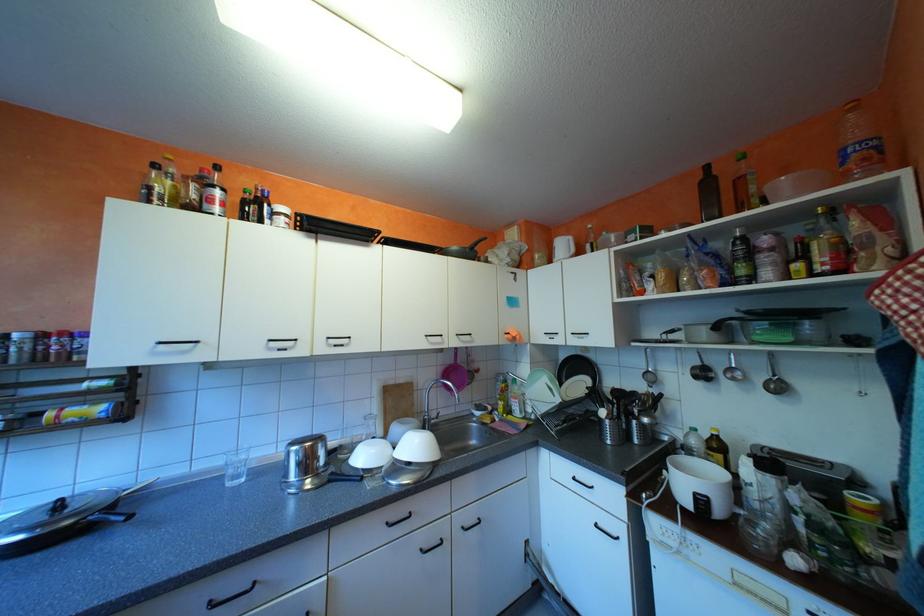
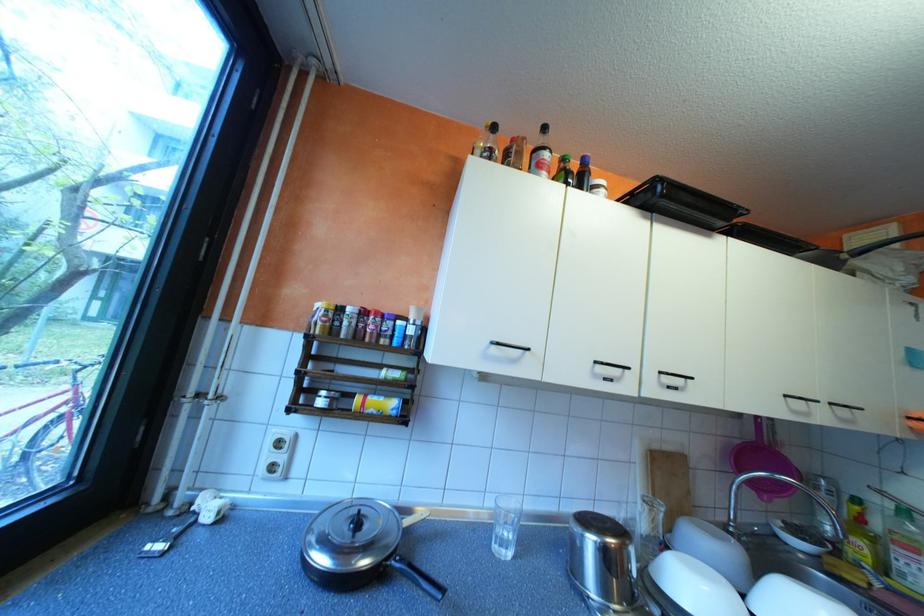
The point at (377, 455) is marked in the first image. Where is the corresponding point in the second image?

(709, 592)